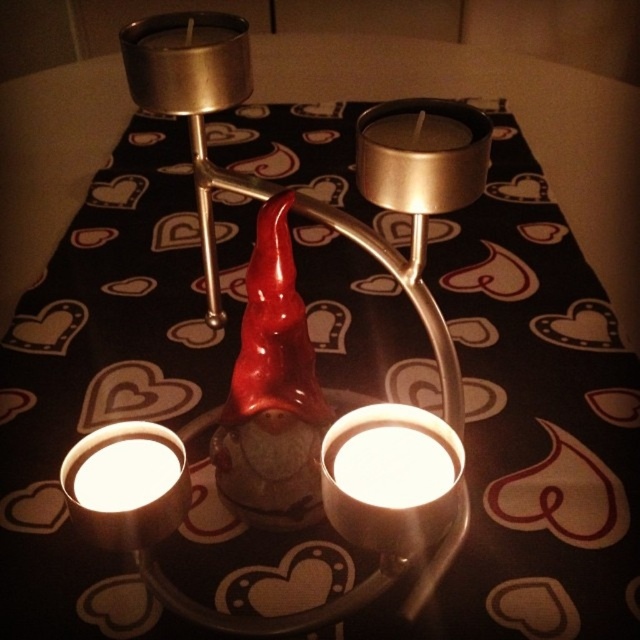
Based on the photo, you are planning to place a decorative ribbon between the brushed metal candle holder at center and the brushed metal candle at upper center. The ribbon is 20 centimeters long. Will the ribbon be long enough to stretch between them?

The distance between the brushed metal candle holder at center and the brushed metal candle at upper center is 21.40 centimeters. Since the ribbon is only 20 centimeters long, it will not be long enough to stretch between them.

Based on the photo, you are setting up a table for a romantic dinner and need to place a decorative figurine between two candle holders. The scene shows a brushed metal candle holder at center and a brushed metal candle at upper center. Which object is positioned lower on the table?

The brushed metal candle holder at center is positioned lower on the table than the brushed metal candle at upper center.

You are setting up a table for a romantic dinner and need to place a centerpiece. You have two candles, the matte silver candle at upper center and the white matte candle at lower left. Which candle should you place closer to the guests to ensure it is more visible?

The matte silver candle at upper center is closer to the viewer than the white matte candle at lower left, so placing it closer to the guests will make it more visible.